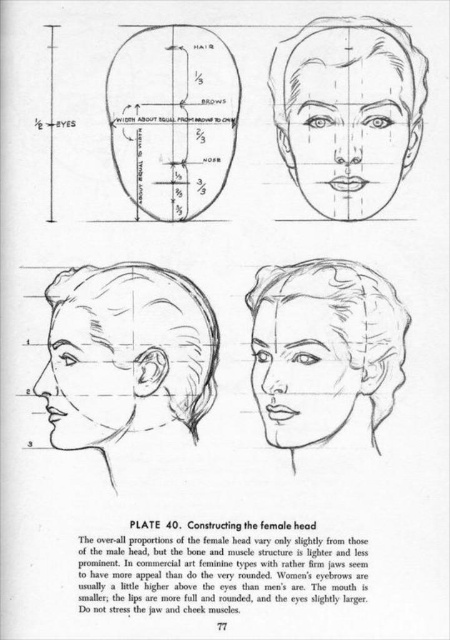
Question: Does smooth skin face at upper center appear under matte black ear at lower left?

Choices:
 (A) no
 (B) yes

Answer: (A)

Question: Can you confirm if smooth skin head at lower left is positioned below matte black ear at lower left?

Choices:
 (A) yes
 (B) no

Answer: (B)

Question: Can you confirm if smooth skin head at lower left is positioned above matte black ear at lower left?

Choices:
 (A) no
 (B) yes

Answer: (B)

Question: Among these points, which one is farthest from the camera?

Choices:
 (A) (134, 394)
 (B) (351, 189)
 (C) (64, 310)

Answer: (C)

Question: Which of the following is the farthest from the observer?

Choices:
 (A) (297, 180)
 (B) (382, 316)

Answer: (A)

Question: Which object appears farthest from the camera in this image?

Choices:
 (A) smooth skin face at center
 (B) smooth skin face at upper center
 (C) smooth skin head at lower left
 (D) matte black ear at lower left

Answer: (C)